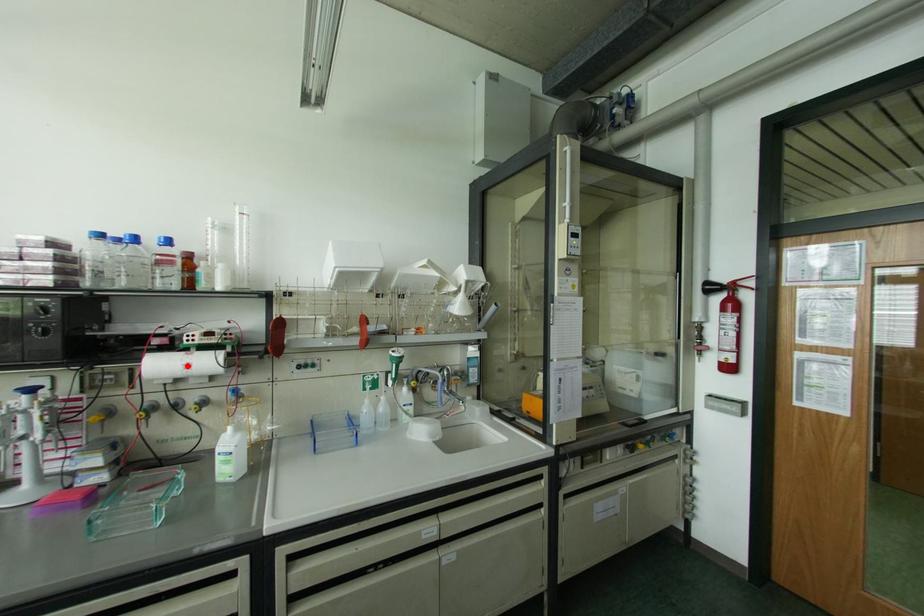
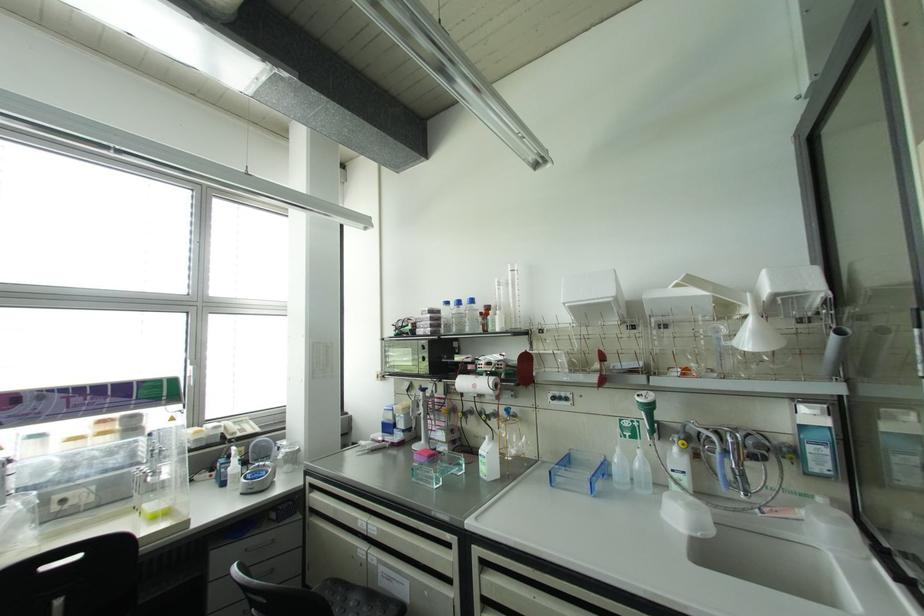
The point at the highlighted location is marked in the first image. Where is the corresponding point in the second image?

(473, 386)